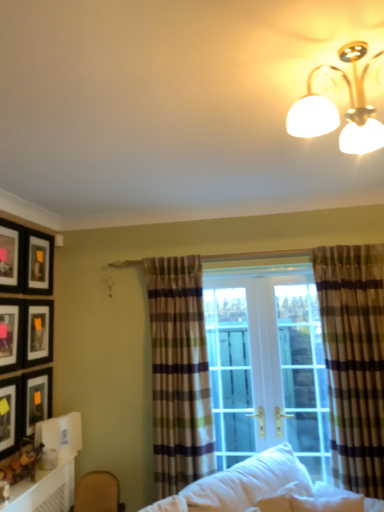
Question: Considering the positions of point (370, 140) and point (344, 385), is point (370, 140) closer or farther from the camera than point (344, 385)?

Choices:
 (A) farther
 (B) closer

Answer: (B)

Question: From a real-world perspective, is gold metallic light fixture at upper right physically located above or below plaid fabric curtain at right, the second curtain from the left?

Choices:
 (A) above
 (B) below

Answer: (A)

Question: Which object is positioned farthest from the matte black picture frame at upper left, placed as the fifth picture frame when sorted from bottom to top?

Choices:
 (A) gold metallic light fixture at upper right
 (B) plaid fabric curtain at right, the first curtain from the right
 (C) metallic silver picture frame at left, which is counted as the 3th picture frame, starting from the top
 (D) matte black picture frame at left, placed as the fifth picture frame when sorted from top to bottom
 (E) white soft pillow at lower center

Answer: (A)

Question: Which is nearer to the matte black picture frame at upper left, placed as the fifth picture frame when sorted from bottom to top?

Choices:
 (A) white glossy table at lower left
 (B) white soft pillow at lower center
 (C) matte black picture frame at upper left, arranged as the 6th picture frame when ordered from the bottom
 (D) plaid fabric curtain at right, the second curtain from the left
 (E) matte black picture frame at lower left, acting as the 6th picture frame starting from the top

Answer: (C)